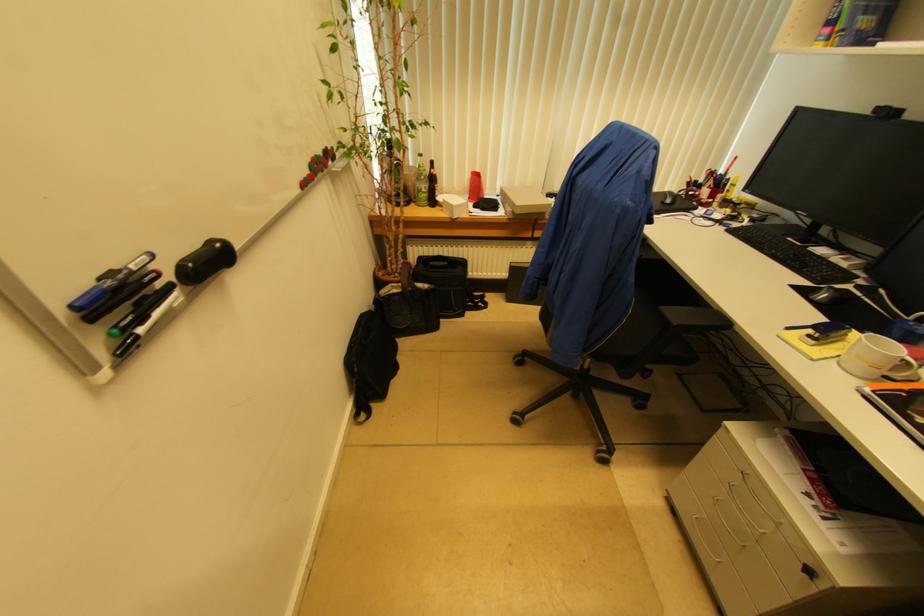
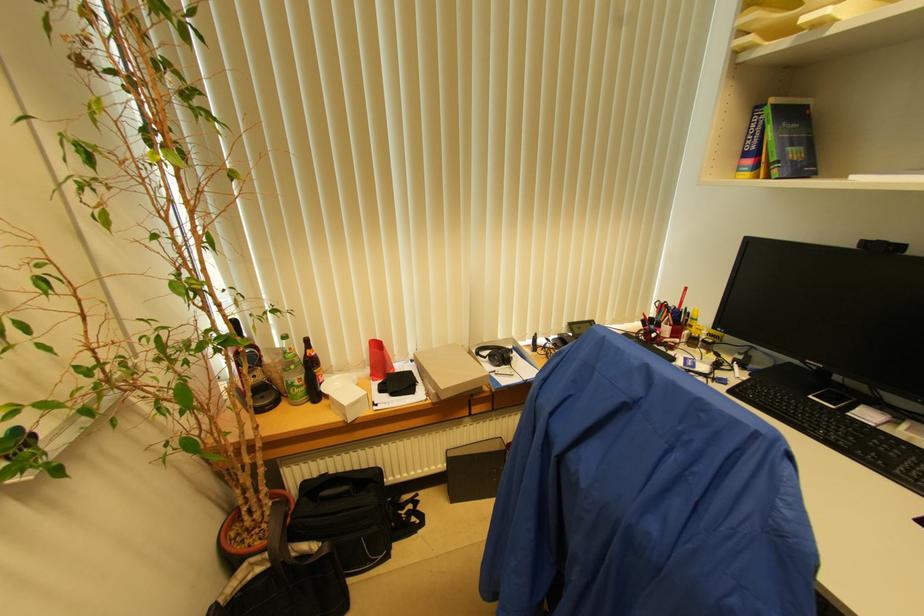
The point at (429, 188) is marked in the first image. Where is the corresponding point in the second image?

(304, 379)